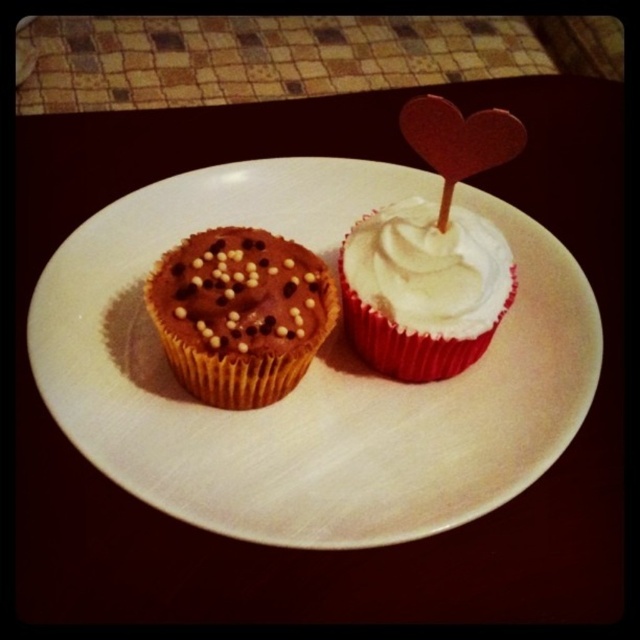
Question: Does matte paper plate at center appear under white matte cupcake at center?

Choices:
 (A) no
 (B) yes

Answer: (B)

Question: Is the position of matte paper plate at center less distant than that of white matte cupcake at center?

Choices:
 (A) no
 (B) yes

Answer: (B)

Question: Which point is closer to the camera taking this photo?

Choices:
 (A) (180, 310)
 (B) (188, 516)

Answer: (B)

Question: Which of the following is the closest to the observer?

Choices:
 (A) (97, 300)
 (B) (310, 257)

Answer: (A)

Question: Which point appears farthest from the camera in this image?

Choices:
 (A) (221, 406)
 (B) (410, 448)
 (C) (362, 285)

Answer: (C)

Question: Can you confirm if matte paper plate at center is bigger than chocolate-coated muffin with sprinkles at left?

Choices:
 (A) yes
 (B) no

Answer: (A)